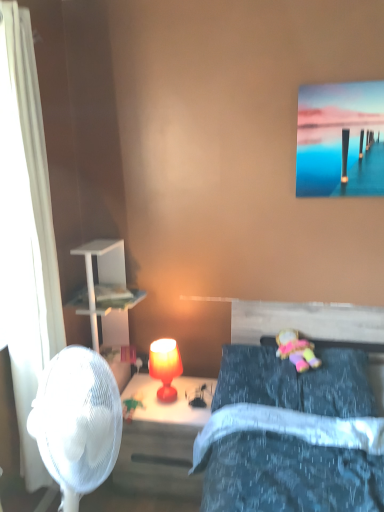
In order to click on free space above matte orange lamp at center (from a real-world perspective) in this screenshot , I will do `click(163, 345)`.